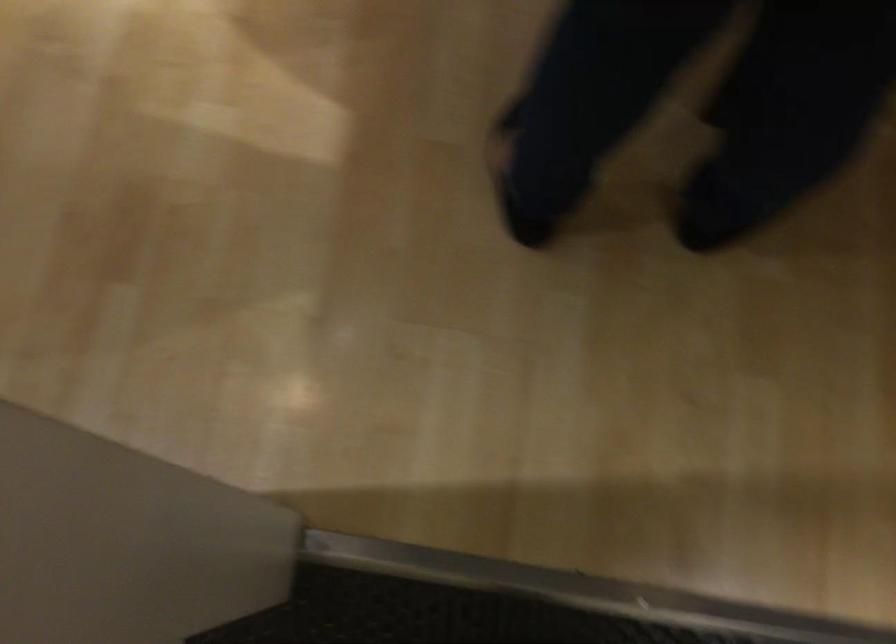
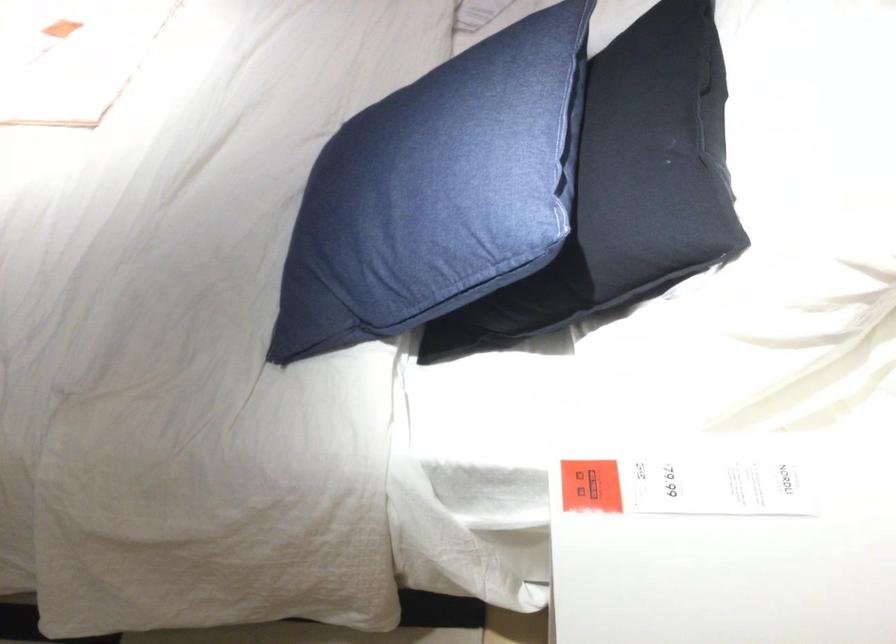
The images are taken continuously from a first-person perspective. In which direction are you moving?

The cameraman moved toward left, backward.